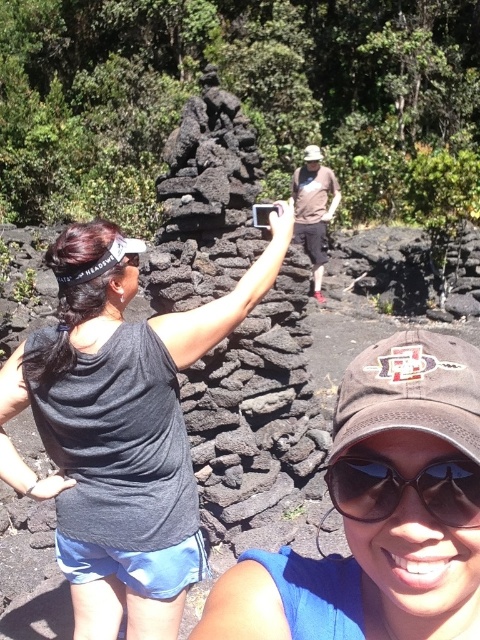
You are standing in the volcanic area and see the matte black tank top at center and the brown fabric baseball hat at center. Which one is positioned more to the left side?

The matte black tank top at center is positioned to the left of the brown fabric baseball hat at center, so the matte black tank top at center is more to the left.

You are a photographer setting up a tripod to capture the scene. The brown fabric cap at center and the black reflective sunglasses at lower center are in your frame. Which object should you adjust to avoid blocking the other, considering their sizes?

The brown fabric cap at center is much taller than the black reflective sunglasses at lower center. To avoid blocking the sunglasses, you should adjust the position of the brown fabric cap at center.